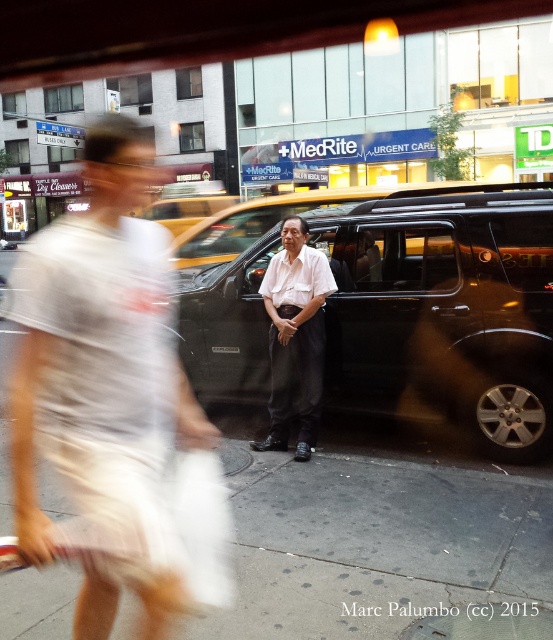
Question: Estimate the real-world distances between objects in this image. Which object is farther from the gray concrete sidewalk at center?

Choices:
 (A) white cotton dress at center
 (B) black glossy limousine at center

Answer: (A)

Question: Can you confirm if white cotton dress at center is positioned below white smooth shirt at center?

Choices:
 (A) yes
 (B) no

Answer: (B)

Question: Which point appears farthest from the camera in this image?

Choices:
 (A) (75, 506)
 (B) (206, 285)
 (C) (279, 563)
 (D) (249, 237)

Answer: (D)

Question: Is white cotton dress at center to the right of black glossy limousine at center from the viewer's perspective?

Choices:
 (A) yes
 (B) no

Answer: (B)

Question: Does white cotton dress at center come in front of yellow metallic taxi at center?

Choices:
 (A) yes
 (B) no

Answer: (A)

Question: Which object is closer to the camera taking this photo?

Choices:
 (A) white smooth shirt at center
 (B) gray concrete sidewalk at center
 (C) yellow metallic taxi at center
 (D) white cotton dress at center

Answer: (D)